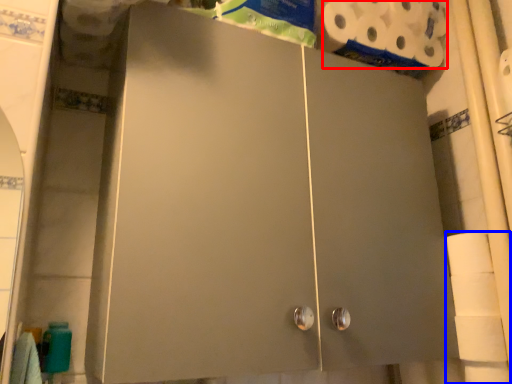
Question: Which object is further to the camera taking this photo, toilet paper (highlighted by a red box) or toilet paper (highlighted by a blue box)?

Choices:
 (A) toilet paper
 (B) toilet paper

Answer: (A)